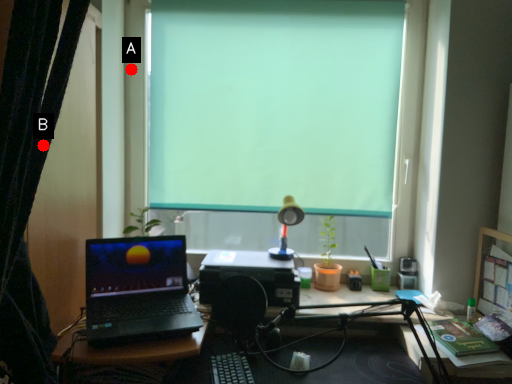
Question: Two points are circled on the image, labeled by A and B beside each circle. Which of the following is the closest to the observer?

Choices:
 (A) A is closer
 (B) B is closer

Answer: (B)